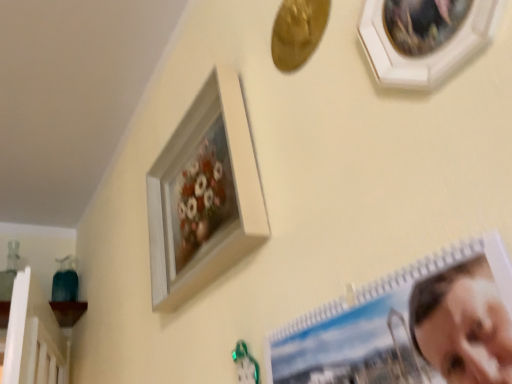
Question: From a real-world perspective, is spiral-bound photo album at lower right, arranged as the first picture frame when viewed from the front, located beneath white wooden picture frame at upper right, the second picture frame when ordered from back to front?

Choices:
 (A) no
 (B) yes

Answer: (B)

Question: Does spiral-bound photo album at lower right, arranged as the first picture frame when viewed from the front, come behind white wooden picture frame at upper right, the second picture frame when ordered from back to front?

Choices:
 (A) yes
 (B) no

Answer: (B)

Question: Does spiral-bound photo album at lower right, placed as the third picture frame when sorted from back to front, have a lesser height compared to white wooden picture frame at upper right, the second picture frame when ordered from back to front?

Choices:
 (A) no
 (B) yes

Answer: (A)

Question: Is spiral-bound photo album at lower right, placed as the third picture frame when sorted from back to front, surrounding white wooden picture frame at upper right, which appears as the 2th picture frame when viewed from the front?

Choices:
 (A) yes
 (B) no

Answer: (B)

Question: Does spiral-bound photo album at lower right, arranged as the first picture frame when viewed from the front, appear on the left side of white wooden picture frame at upper right, which appears as the 2th picture frame when viewed from the front?

Choices:
 (A) no
 (B) yes

Answer: (B)

Question: Can you confirm if spiral-bound photo album at lower right, arranged as the first picture frame when viewed from the front, is positioned to the right of white wooden picture frame at upper right, which appears as the 2th picture frame when viewed from the front?

Choices:
 (A) no
 (B) yes

Answer: (A)

Question: Are white matte picture frame at upper center, the 3th picture frame in the front-to-back sequence, and spiral-bound photo album at lower right, arranged as the first picture frame when viewed from the front, making contact?

Choices:
 (A) yes
 (B) no

Answer: (B)

Question: Is white matte picture frame at upper center, the 3th picture frame in the front-to-back sequence, to the left of spiral-bound photo album at lower right, placed as the third picture frame when sorted from back to front, from the viewer's perspective?

Choices:
 (A) yes
 (B) no

Answer: (A)

Question: Is white matte picture frame at upper center, which ranks as the 1th picture frame in back-to-front order, positioned beyond the bounds of spiral-bound photo album at lower right, arranged as the first picture frame when viewed from the front?

Choices:
 (A) no
 (B) yes

Answer: (B)

Question: Could you tell me if white matte picture frame at upper center, the 3th picture frame in the front-to-back sequence, is turned towards spiral-bound photo album at lower right, placed as the third picture frame when sorted from back to front?

Choices:
 (A) no
 (B) yes

Answer: (A)

Question: From the image's perspective, would you say white matte picture frame at upper center, the 3th picture frame in the front-to-back sequence, is positioned over spiral-bound photo album at lower right, arranged as the first picture frame when viewed from the front?

Choices:
 (A) no
 (B) yes

Answer: (B)

Question: Is white matte picture frame at upper center, which ranks as the 1th picture frame in back-to-front order, to the right of spiral-bound photo album at lower right, placed as the third picture frame when sorted from back to front, from the viewer's perspective?

Choices:
 (A) no
 (B) yes

Answer: (A)

Question: Is spiral-bound photo album at lower right, placed as the third picture frame when sorted from back to front, with white matte picture frame at upper center, the 3th picture frame in the front-to-back sequence?

Choices:
 (A) yes
 (B) no

Answer: (B)